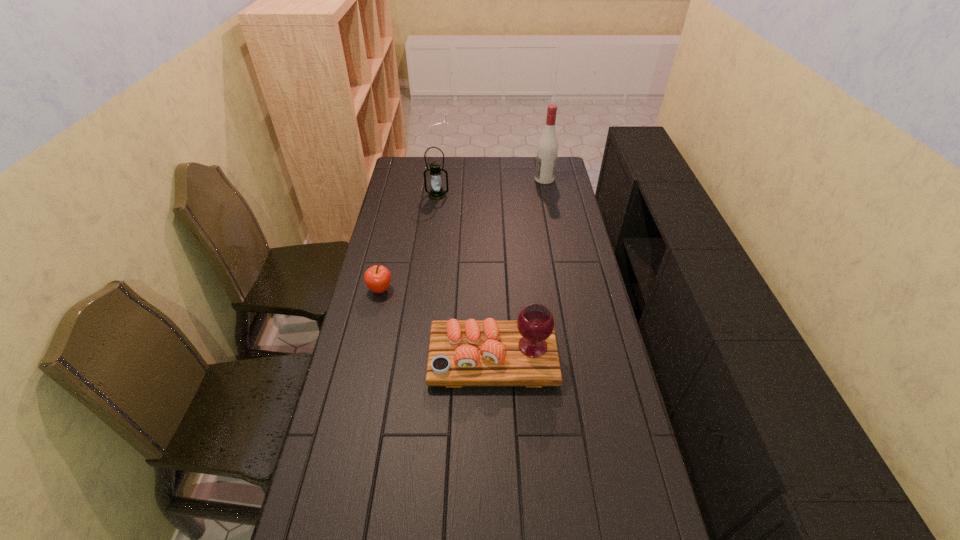
Find the location of a particular element. This screenshot has height=540, width=960. vacant position located 0.170m on the label of the tallest object is located at coordinates (500, 179).

Find the location of `free location located 0.280m on the side where the second farthest object emits light`. free location located 0.280m on the side where the second farthest object emits light is located at coordinates (432, 238).

Locate an element on the screen. vacant space situated 0.320m on the front of the nearest object is located at coordinates (496, 502).

I want to click on free space located 0.120m on the back of the leftmost object, so click(x=387, y=260).

The image size is (960, 540). Identify the location of object present at the far edge. 547,150.

I want to click on object at the left edge, so click(377, 278).

This screenshot has width=960, height=540. What are the coordinates of `object situated at the right edge` in the screenshot? It's located at (547, 150).

Identify the location of object situated at the far right corner. coord(547,150).

Find the location of a particular element. This screenshot has width=960, height=540. free space at the far edge of the desktop is located at coordinates (491, 179).

Where is `free space at the left edge of the desktop`? The image size is (960, 540). free space at the left edge of the desktop is located at coordinates (406, 224).